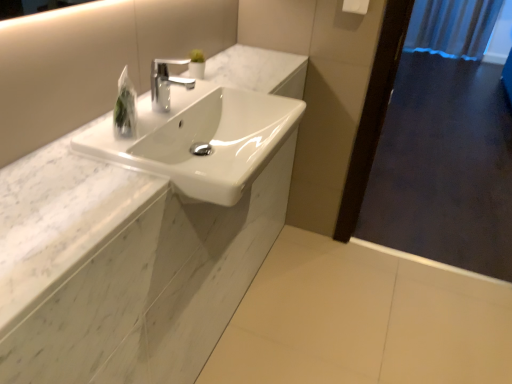
What do you see at coordinates (445, 147) in the screenshot? This screenshot has width=512, height=384. I see `dark wood screen door at right` at bounding box center [445, 147].

What is the approximate width of dark wood screen door at right?

dark wood screen door at right is 4.07 inches in width.

In order to face white marble counter at center, should I rotate leftwards or rightwards?

You should rotate left by 9.570 degrees.

Describe the element at coordinates (201, 139) in the screenshot. I see `white glossy sink at center` at that location.

This screenshot has height=384, width=512. What do you see at coordinates (355, 6) in the screenshot?
I see `white plastic towel bar at upper right` at bounding box center [355, 6].

Describe the element at coordinates (166, 83) in the screenshot. The height and width of the screenshot is (384, 512). I see `polished chrome faucet at center` at that location.

Measure the distance between point (128, 78) and camera.

The distance of point (128, 78) from camera is 1.11 meters.

Identify the location of dark wood screen door at right. This screenshot has height=384, width=512. (445, 147).

In the scene shown: Is white glossy sink at center surrounding blue fabric shower curtain at upper right?

No, blue fabric shower curtain at upper right is not a part of white glossy sink at center.

From the image's perspective, is white glossy sink at center above or below blue fabric shower curtain at upper right?

Based on their image positions, white glossy sink at center is located beneath blue fabric shower curtain at upper right.

Between white glossy sink at center and blue fabric shower curtain at upper right, which one has less height?

white glossy sink at center is shorter.

Which is more to the left, white glossy sink at center or blue fabric shower curtain at upper right?

Positioned to the left is white glossy sink at center.

Is white glossy sink at center next to dark wood screen door at right and touching it?

white glossy sink at center is not next to dark wood screen door at right, and they're not touching.

Considering the positions of objects white glossy sink at center and dark wood screen door at right in the image provided, who is more to the right, white glossy sink at center or dark wood screen door at right?

dark wood screen door at right.

Can you confirm if white glossy sink at center is bigger than dark wood screen door at right?

Actually, white glossy sink at center might be smaller than dark wood screen door at right.

Is dark wood screen door at right inside white glossy sink at center?

That's incorrect, dark wood screen door at right is not inside white glossy sink at center.

From a real-world perspective, is white marble counter at center below dark wood screen door at right?

No, from a real-world perspective, white marble counter at center is not under dark wood screen door at right.

From the image's perspective, which is above, white marble counter at center or dark wood screen door at right?

white marble counter at center.

Between white marble counter at center and dark wood screen door at right, which one is positioned in front?

white marble counter at center is more forward.

Could white plastic towel bar at upper right be considered to be inside polished chrome faucet at center?

That's incorrect, white plastic towel bar at upper right is not inside polished chrome faucet at center.

Is polished chrome faucet at center to the right of white plastic towel bar at upper right from the viewer's perspective?

In fact, polished chrome faucet at center is to the left of white plastic towel bar at upper right.

From the picture: How different are the orientations of polished chrome faucet at center and white plastic towel bar at upper right in degrees?

93.2 degrees.

Is polished chrome faucet at center wider or thinner than white plastic towel bar at upper right?

polished chrome faucet at center is wider than white plastic towel bar at upper right.

Looking at the image, does blue fabric shower curtain at upper right seem bigger or smaller compared to white glossy sink at center?

blue fabric shower curtain at upper right is bigger than white glossy sink at center.

At what (x,y) coordinates should I click in order to perform the action: click on shower curtain on the right of white glossy sink at center. Please return your answer as a coordinate pair (x, y). Looking at the image, I should click on (452, 27).

Consider the image. Is blue fabric shower curtain at upper right in front of or behind white glossy sink at center in the image?

Clearly, blue fabric shower curtain at upper right is behind white glossy sink at center.

Consider the image. From the image's perspective, which one is positioned lower, white marble counter at center or clear plastic bag at upper center?

clear plastic bag at upper center is shown below in the image.

Which of these two, white marble counter at center or clear plastic bag at upper center, is bigger?

white marble counter at center is bigger.

From a real-world perspective, is white marble counter at center physically below clear plastic bag at upper center?

→ Indeed, from a real-world perspective, white marble counter at center is positioned beneath clear plastic bag at upper center.

Between white marble counter at center and clear plastic bag at upper center, which one has larger width?

With larger width is white marble counter at center.

Is white marble counter at center looking in the opposite direction of white glossy sink at center?

Yes, white marble counter at center's orientation is away from white glossy sink at center.

Between white marble counter at center and white glossy sink at center, which one appears on the left side from the viewer's perspective?

Positioned to the left is white marble counter at center.

Locate an element on the screen. The height and width of the screenshot is (384, 512). counter above the white glossy sink at center (from a real-world perspective) is located at coordinates (125, 270).

Between white marble counter at center and white glossy sink at center, which one has more height?

With more height is white glossy sink at center.

Find the location of `shower curtain behind the white glossy sink at center`. shower curtain behind the white glossy sink at center is located at coordinates (452, 27).

You are a GUI agent. You are given a task and a screenshot of the screen. Output one action in this format:
    pyautogui.click(x=<x>, y=<y>)
    Task: Click on the sink in front of the dark wood screen door at right
    The width and height of the screenshot is (512, 384).
    Given the screenshot: What is the action you would take?
    pyautogui.click(x=201, y=139)

Estimate the real-world distances between objects in this image. Which object is closer to white marble counter at center, dark wood screen door at right or white glossy sink at center?

Based on the image, white glossy sink at center appears to be nearer to white marble counter at center.

When comparing their distances from dark wood screen door at right, does blue fabric shower curtain at upper right or white glossy sink at center seem closer?

white glossy sink at center is closer to dark wood screen door at right.

Looking at the image, which one is located closer to dark wood screen door at right, white plastic towel bar at upper right or blue fabric shower curtain at upper right?

blue fabric shower curtain at upper right lies closer to dark wood screen door at right than the other object.

Considering their positions, is polished chrome faucet at center positioned closer to white glossy sink at center than white marble counter at center?

polished chrome faucet at center lies closer to white glossy sink at center than the other object.

Consider the image. Looking at the image, which one is located further to blue fabric shower curtain at upper right, white marble counter at center or white plastic towel bar at upper right?

white marble counter at center is further to blue fabric shower curtain at upper right.

Looking at this image, when comparing their distances from polished chrome faucet at center, does blue fabric shower curtain at upper right or white glossy sink at center seem further?

Based on the image, blue fabric shower curtain at upper right appears to be further to polished chrome faucet at center.

Considering their positions, is white plastic towel bar at upper right positioned closer to polished chrome faucet at center than white glossy sink at center?

Based on the image, white glossy sink at center appears to be nearer to polished chrome faucet at center.

Consider the image. Looking at the image, which one is located closer to blue fabric shower curtain at upper right, polished chrome faucet at center or white plastic towel bar at upper right?

white plastic towel bar at upper right.

The height and width of the screenshot is (384, 512). I want to click on screen door between polished chrome faucet at center and blue fabric shower curtain at upper right from front to back, so [x=445, y=147].

This screenshot has width=512, height=384. I want to click on tap positioned between white marble counter at center and white plastic towel bar at upper right from near to far, so click(166, 83).

Locate an element on the screen. The image size is (512, 384). tap between white glossy sink at center and white plastic towel bar at upper right from front to back is located at coordinates (166, 83).

Where is `tap positioned between white marble counter at center and blue fabric shower curtain at upper right from near to far`? This screenshot has height=384, width=512. tap positioned between white marble counter at center and blue fabric shower curtain at upper right from near to far is located at coordinates (166, 83).